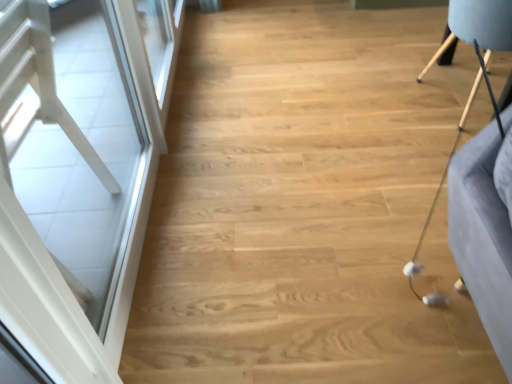
Find the location of `free region under white glossy screen door at left (from a real-world perspective)`. free region under white glossy screen door at left (from a real-world perspective) is located at coordinates (141, 228).